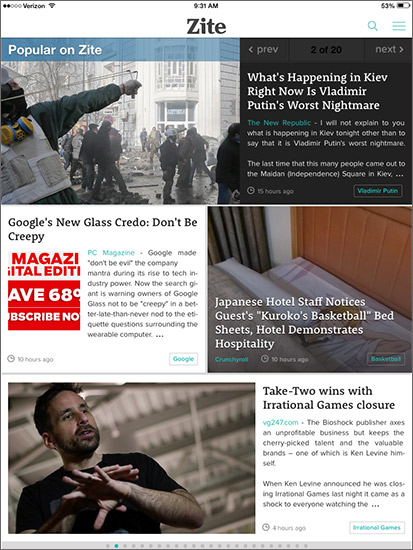
Locate an element on the screen. Image resolution: width=413 pixels, height=550 pixels. interior wall is located at coordinates (279, 230).